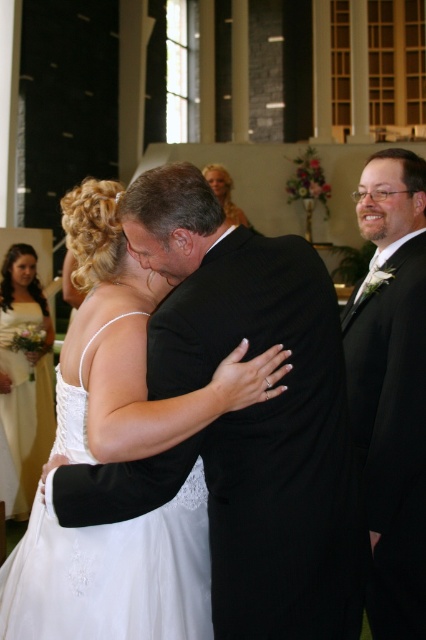
Question: Which object is positioned farthest from the black satin suit at right?

Choices:
 (A) white satin dress at left
 (B) blonde hair at upper center
 (C) white satin dress at center

Answer: (B)

Question: Can you confirm if white satin dress at center is positioned to the left of blonde hair at upper center?

Choices:
 (A) no
 (B) yes

Answer: (B)

Question: Is white satin dress at center to the left of blonde hair at upper center from the viewer's perspective?

Choices:
 (A) yes
 (B) no

Answer: (A)

Question: Estimate the real-world distances between objects in this image. Which object is farther from the white satin dress at center?

Choices:
 (A) black satin suit at right
 (B) white satin dress at left
 (C) blonde hair at upper center

Answer: (C)

Question: Is black satin suit at right smaller than white satin dress at left?

Choices:
 (A) no
 (B) yes

Answer: (B)

Question: Which of the following is the closest to the observer?

Choices:
 (A) blonde hair at upper center
 (B) white satin dress at center

Answer: (B)